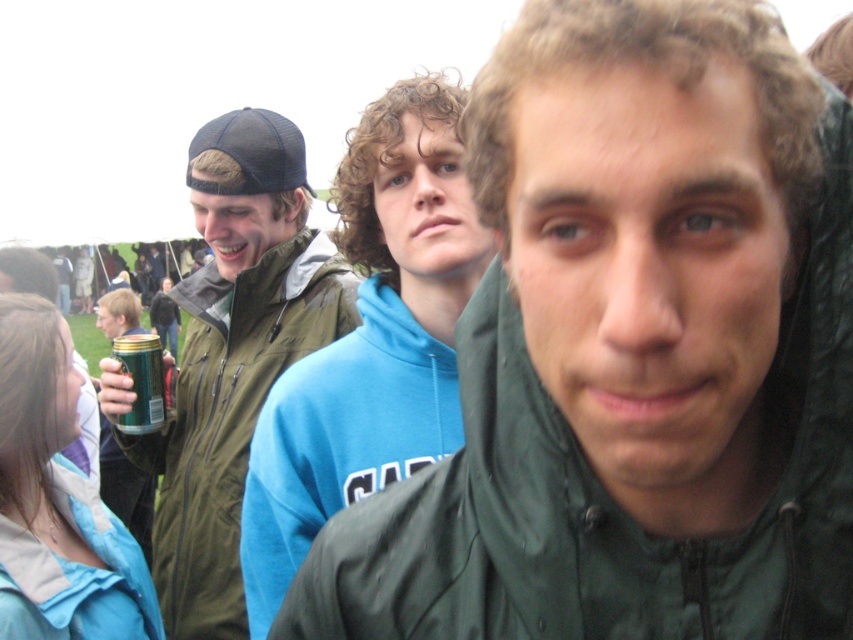
What is the color of the jacket worn by the person located at the coordinates point [234,355]?

The point [234,355] indicates the green matte jacket at left, so the jacket is green.